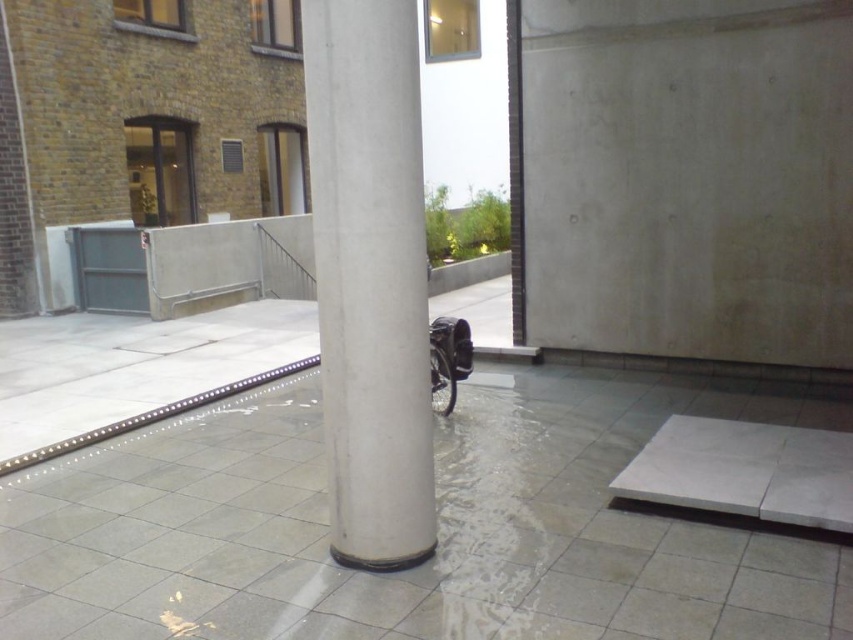
You are a delivery person with a cart that is 1.2 meters wide. You need to navigate through the courtyard to reach the delivery entrance located near the yellowish brown brick building on the left. Can you pass through the white smooth concrete pillar at center and the white concrete ramp at lower right without tilting your cart?

The white smooth concrete pillar at center has a width less than the white concrete ramp at lower right. Since the cart is 1.2 meters wide, you need to check the minimum width between these two objects. However, the description only compares their widths but does not provide exact measurements. Therefore, it is uncertain if the cart can pass without tilting. Please verify the actual dimensions on site.

You are a delivery person carrying a large package that requires a clear path to the entrance located at the top of the white concrete ramp at lower right. The white smooth concrete pillar at center is blocking your way. Can you navigate around it to reach the ramp without moving the pillar?

The white smooth concrete pillar at center is bigger than the white concrete ramp at lower right, so you can go around the pillar on either side to reach the ramp since the pillar is not as wide as the ramp, allowing enough space to maneuver around it.

You are standing at the entrance of the courtyard and want to reach the white smooth concrete pillar at center. According to the coordinates provided, in which direction should you move from your current position to reach it?

The white smooth concrete pillar at center is located at coordinates point [370,276]. Since you are at the entrance, which is likely at the edge of the courtyard, you should move towards the center of the courtyard to reach it.